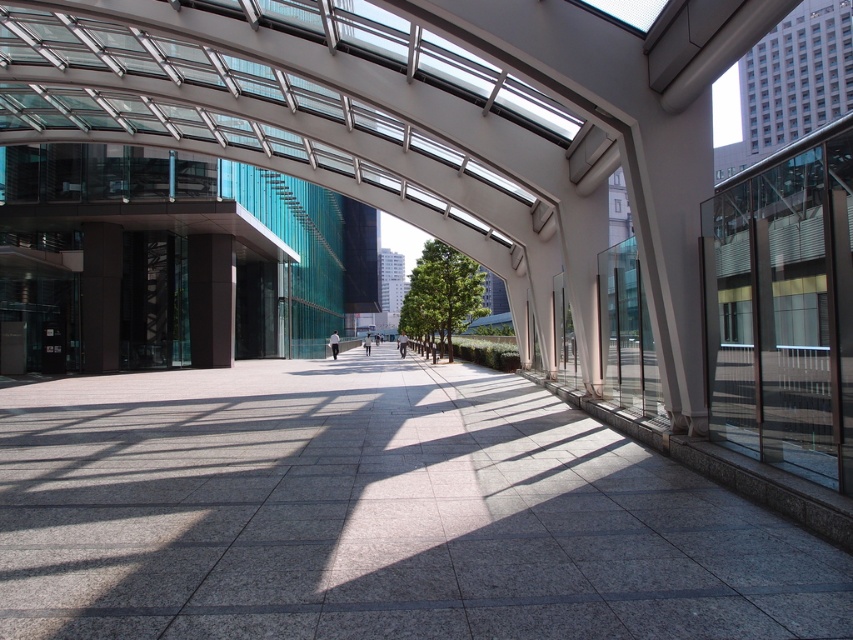
Question: Which of the following is the closest to the observer?

Choices:
 (A) gray polished stone pavement at center
 (B) satin black pillar at center

Answer: (A)

Question: Can you confirm if gray polished stone pavement at center is positioned to the left of satin black pillar at center?

Choices:
 (A) yes
 (B) no

Answer: (B)

Question: In this image, where is gray polished stone pavement at center located relative to satin black pillar at center?

Choices:
 (A) below
 (B) above

Answer: (A)

Question: Can you confirm if gray polished stone pavement at center is positioned to the left of satin black pillar at center?

Choices:
 (A) no
 (B) yes

Answer: (A)

Question: Which point is closer to the camera taking this photo?

Choices:
 (A) [305, 520]
 (B) [212, 323]

Answer: (A)